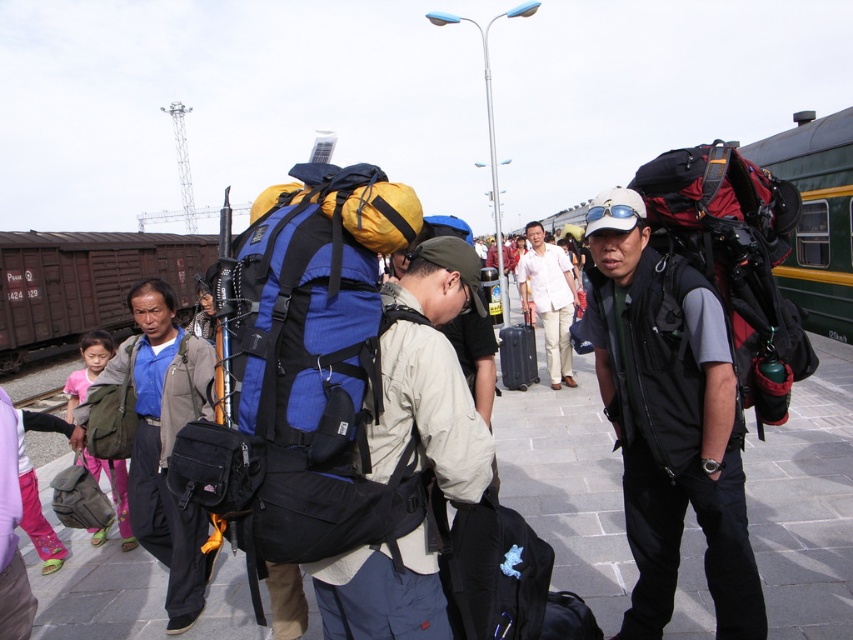
You are a photographer standing on the platform at the train station. You want to take a photo of the white cotton shirt at center and the metal train track at lower left. Which object will appear larger in your photo?

The white cotton shirt at center will appear larger in the photo because it is much taller than the metal train track at lower left.

You are a traveler standing on the platform and want to check your backpacks. Which backpack is higher up, the matte black backpack at center or the matte green backpack at left?

The matte black backpack at center is higher up than the matte green backpack at left because it is positioned above it.

You are a traveler at the train station and have both the blue fabric backpack at center and the black hardshell suitcase at center. You want to store a tall hiking pole. Which item should you choose?

The blue fabric backpack at center is much taller than the black hardshell suitcase at center, so you should choose the blue fabric backpack at center to store the tall hiking pole.